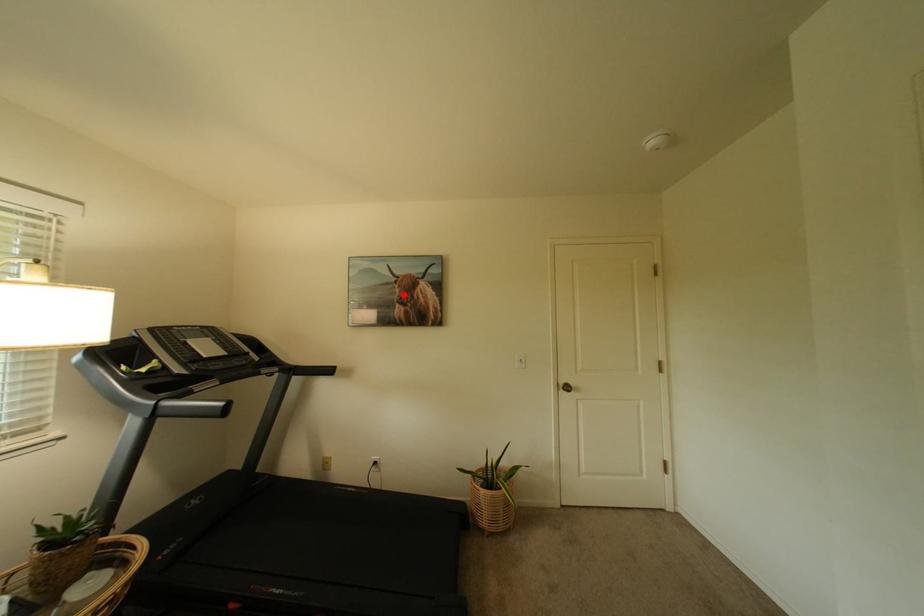
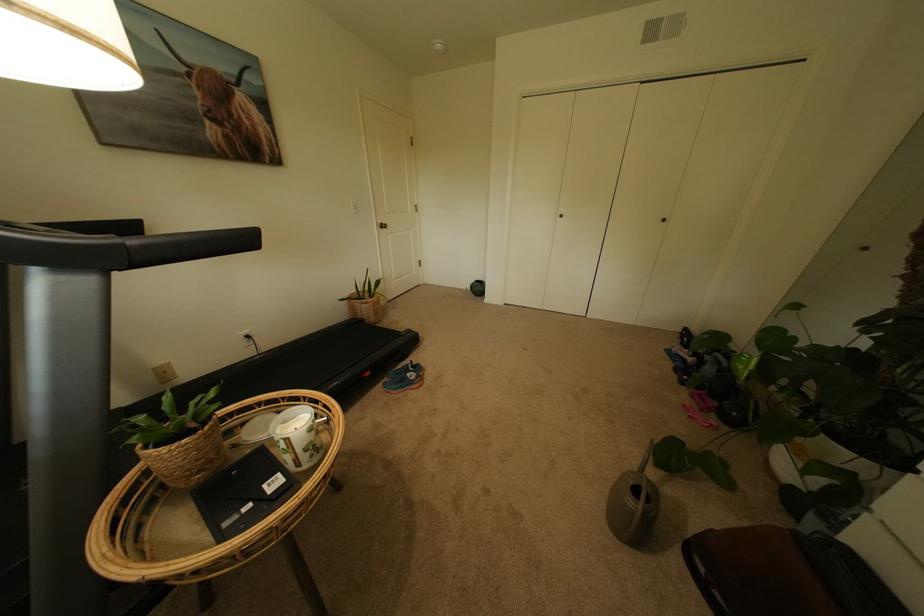
In the second image, find the point that corresponds to the highlighted location in the first image.

(204, 100)